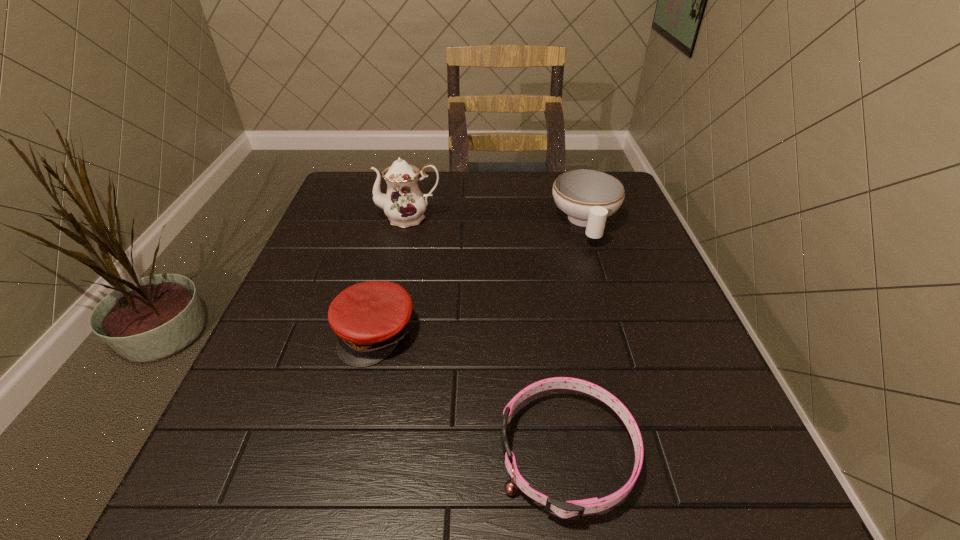
Where is `vacant space located 0.170m on the front of the third tallest object with an emblem`? The image size is (960, 540). vacant space located 0.170m on the front of the third tallest object with an emblem is located at coordinates (346, 461).

Find the location of `free space located 0.310m with the buckle on the shortest object`. free space located 0.310m with the buckle on the shortest object is located at coordinates (296, 453).

Where is `vacant area situated with the buckle on the shortest object`? vacant area situated with the buckle on the shortest object is located at coordinates [235, 453].

What are the coordinates of `vacant area located 0.240m with the buckle on the shortest object` in the screenshot? It's located at (342, 453).

This screenshot has height=540, width=960. Identify the location of object at the near edge. (570, 510).

Locate an element on the screen. This screenshot has height=540, width=960. chinaware that is positioned at the left edge is located at coordinates (404, 204).

Find the location of a particular element. The width and height of the screenshot is (960, 540). cap that is at the left edge is located at coordinates (370, 318).

This screenshot has width=960, height=540. Identify the location of object that is positioned at the right edge. (588, 197).

This screenshot has height=540, width=960. I want to click on object that is at the far left corner, so (x=404, y=204).

I want to click on object that is at the far right corner, so click(x=588, y=197).